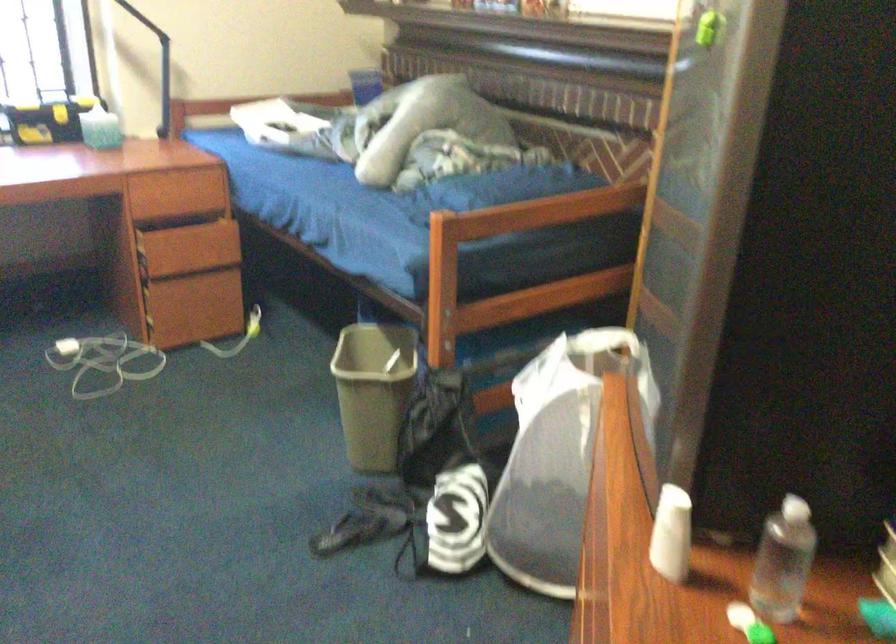
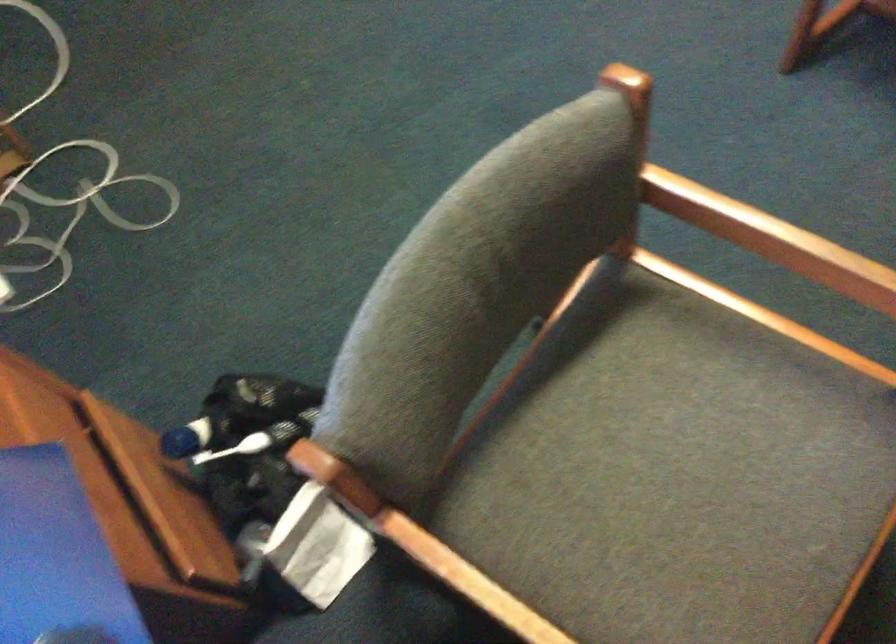
Find the pixel in the second image that matches pixel 145 362 in the first image.

(63, 184)